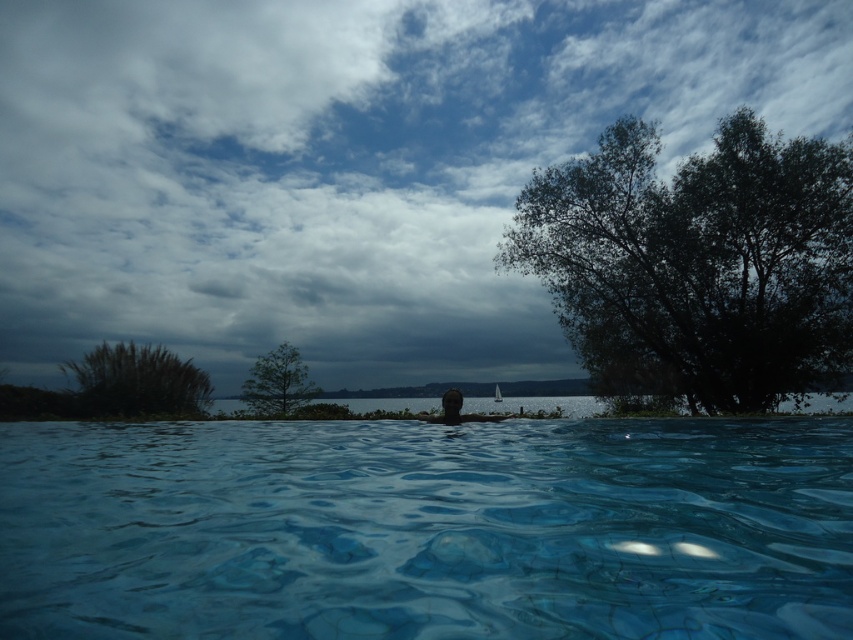
Can you confirm if green leafy tree at right is positioned to the left of green grassy bush at upper left?

No, green leafy tree at right is not to the left of green grassy bush at upper left.

Does point (650, 248) come farther from viewer compared to point (134, 396)?

No, (650, 248) is closer to viewer.

At what (x,y) coordinates should I click in order to perform the action: click on green leafy tree at right. Please return your answer as a coordinate pair (x, y). This screenshot has height=640, width=853. Looking at the image, I should click on (695, 262).

Find the location of `green leafy tree at right`. green leafy tree at right is located at coordinates (695, 262).

Which is more to the right, cloudy sky at upper center or green leafy tree at right?

green leafy tree at right is more to the right.

Which is behind, point (778, 106) or point (810, 204)?

Point (778, 106)

Is point (763, 36) positioned behind point (724, 280)?

Yes, it is.

This screenshot has height=640, width=853. I want to click on cloudy sky at upper center, so click(x=344, y=164).

Which is below, transparent glass pool at center or green leafy tree at right?

transparent glass pool at center is lower down.

Does transparent glass pool at center have a smaller size compared to green leafy tree at right?

Correct, transparent glass pool at center occupies less space than green leafy tree at right.

Describe the element at coordinates (427, 529) in the screenshot. I see `transparent glass pool at center` at that location.

Where is `transparent glass pool at center`? transparent glass pool at center is located at coordinates (427, 529).